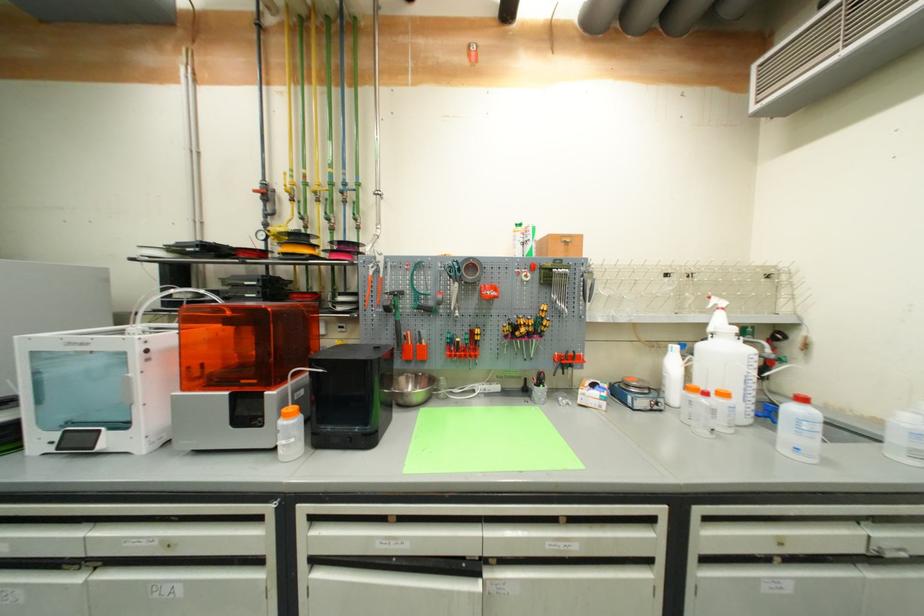
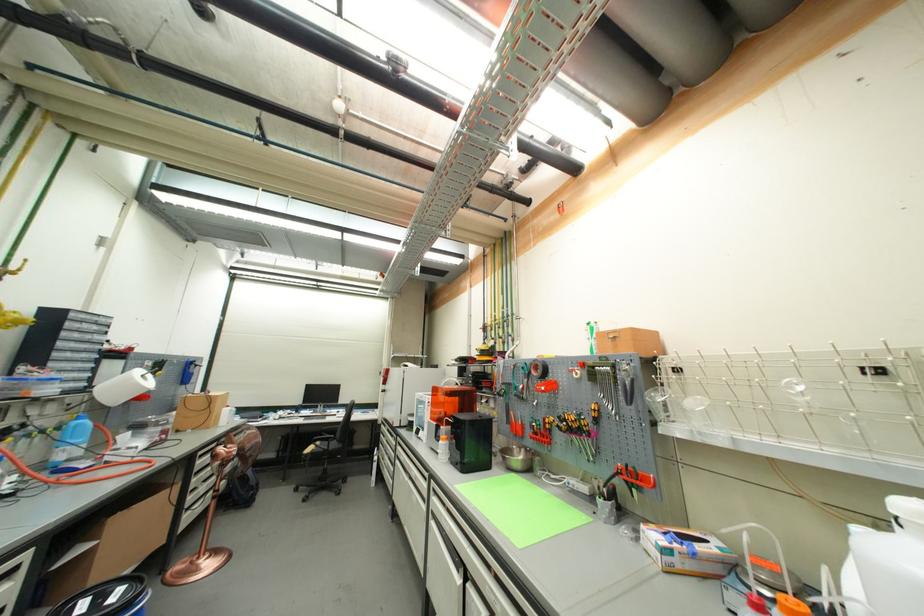
Find the pixel in the second image that matches pixel 549 318 in the first image.

(602, 418)